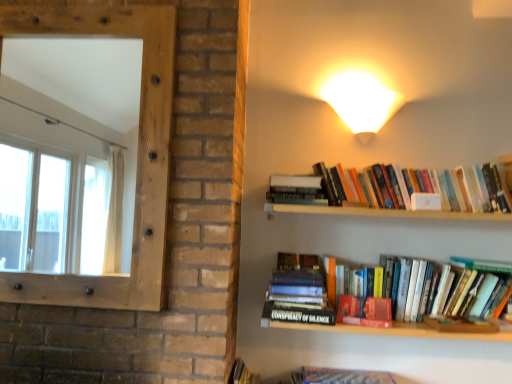
Question: Is natural wood frame at left looking in the opposite direction of hardcover books at upper right, arranged as the 1th book when viewed from the top?

Choices:
 (A) no
 (B) yes

Answer: (A)

Question: Is natural wood frame at left far away from hardcover books at upper right, which ranks as the second book in bottom-to-top order?

Choices:
 (A) yes
 (B) no

Answer: (B)

Question: Does natural wood frame at left have a smaller size compared to hardcover books at upper right, the 2th book viewed from the left?

Choices:
 (A) yes
 (B) no

Answer: (B)

Question: From a real-world perspective, is natural wood frame at left located higher than hardcover books at upper right, arranged as the 1th book when viewed from the top?

Choices:
 (A) yes
 (B) no

Answer: (A)

Question: Is natural wood frame at left in front of hardcover books at upper right, the 2th book viewed from the left?

Choices:
 (A) yes
 (B) no

Answer: (A)

Question: Choose the correct answer: Is hardcover books at upper right, arranged as the 1th book when viewed from the top, inside hardcover book at center, the 1th book viewed from the left, or outside it?

Choices:
 (A) outside
 (B) inside

Answer: (A)

Question: From a real-world perspective, is hardcover books at upper right, the 2th book viewed from the left, physically located above or below hardcover book at center, the second book viewed from the top?

Choices:
 (A) above
 (B) below

Answer: (A)

Question: From their relative heights in the image, would you say hardcover books at upper right, which ranks as the second book in bottom-to-top order, is taller or shorter than hardcover book at center, the second book viewed from the top?

Choices:
 (A) tall
 (B) short

Answer: (B)

Question: Considering the relative positions of hardcover books at upper right, which ranks as the second book in bottom-to-top order, and hardcover book at center, the 1th book viewed from the left, in the image provided, is hardcover books at upper right, which ranks as the second book in bottom-to-top order, to the left or to the right of hardcover book at center, the 1th book viewed from the left,?

Choices:
 (A) left
 (B) right

Answer: (B)

Question: Considering the positions of point (302, 304) and point (117, 296), is point (302, 304) closer or farther from the camera than point (117, 296)?

Choices:
 (A) closer
 (B) farther

Answer: (B)

Question: Relative to natural wood frame at left, is hardcover book at center, placed as the first book when sorted from bottom to top, in front or behind?

Choices:
 (A) behind
 (B) front

Answer: (A)

Question: From the image's perspective, is hardcover book at center, the 1th book viewed from the left, positioned above or below natural wood frame at left?

Choices:
 (A) above
 (B) below

Answer: (B)

Question: Is hardcover book at center, the 1th book viewed from the left, wider or thinner than natural wood frame at left?

Choices:
 (A) thin
 (B) wide

Answer: (B)

Question: Would you say white glossy wall sconce at upper right is to the left or to the right of hardcover books at upper right, arranged as the 1th book when viewed from the top, in the picture?

Choices:
 (A) right
 (B) left

Answer: (B)

Question: Is white glossy wall sconce at upper right bigger or smaller than hardcover books at upper right, the 2th book viewed from the left?

Choices:
 (A) small
 (B) big

Answer: (A)